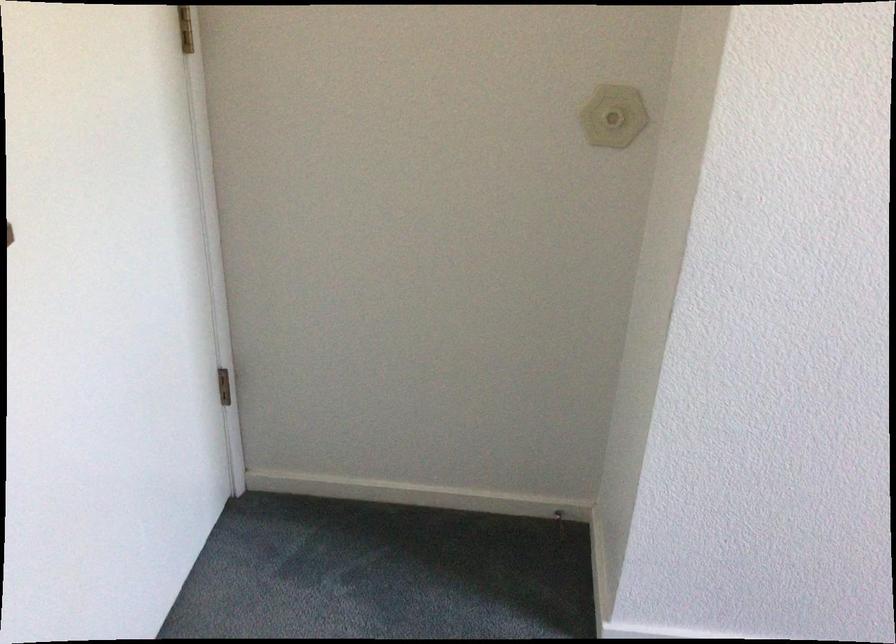
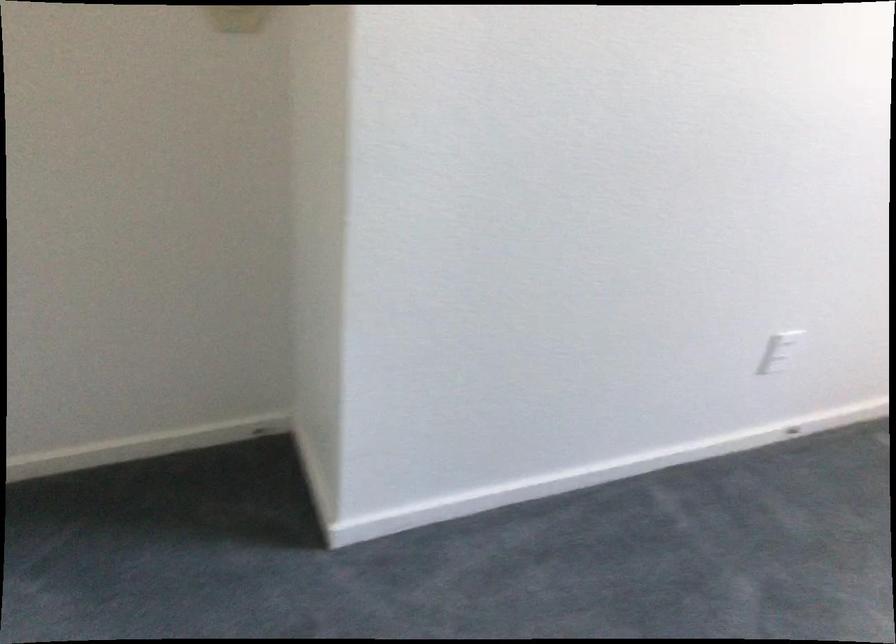
Question: Based on the continuous images, in which direction is the camera rotating? Reply with the corresponding letter.

Choices:
 (A) Left
 (B) Right
 (C) Up
 (D) Down

Answer: (B)